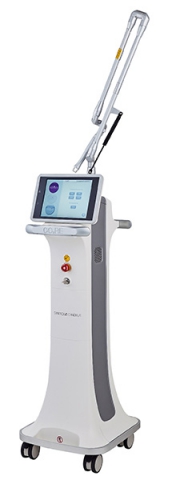
Identify the location of screen. (63, 205).